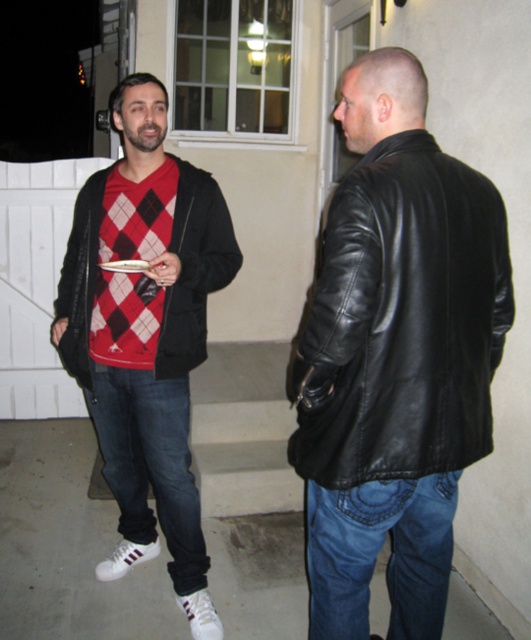
You are trying to decide which piece of clothing to take with you from the scene. Both the matte black hoodie at left and the matte black jacket at left are available. If you want the bigger one, which should you choose?

The matte black hoodie at left is larger in size than the matte black jacket at left, so you should choose the matte black hoodie at left.

You are a delivery robot that needs to place a package between the matte black hoodie at left and the denim jeans at lower right. The package requires 30 inches of space. Will there be enough space?

The matte black hoodie at left is 33.29 inches from the denim jeans at lower right, so yes, the package will fit as the distance is greater than 30 inches.